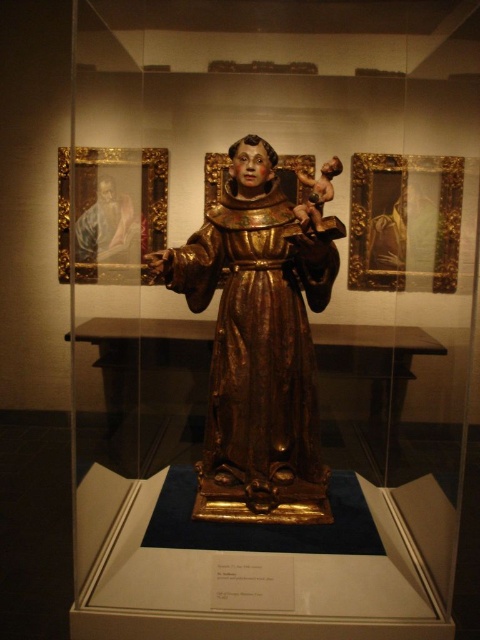
Can you confirm if gold polished wood statue at center is positioned to the right of matte gold frame at upper left?

Indeed, gold polished wood statue at center is positioned on the right side of matte gold frame at upper left.

Looking at this image, can you confirm if gold polished wood statue at center is smaller than matte gold frame at upper left?

Actually, gold polished wood statue at center might be larger than matte gold frame at upper left.

Does point (300, 276) come in front of point (129, 161)?

Yes, point (300, 276) is closer to viewer.

Locate an element on the screen. Image resolution: width=480 pixels, height=640 pixels. gold polished wood statue at center is located at coordinates (260, 339).